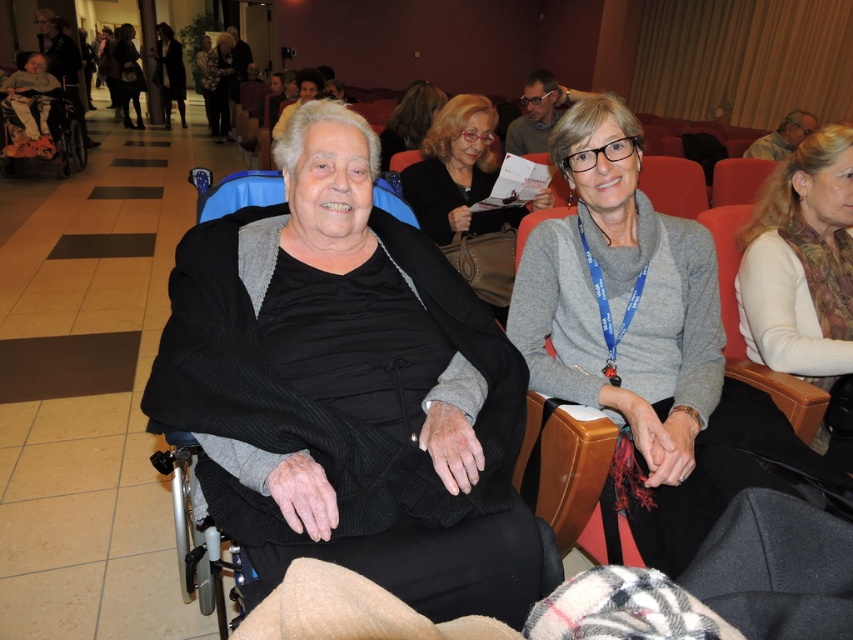
Question: Can you confirm if black knit sweater at center is bigger than matte black dress at center?

Choices:
 (A) no
 (B) yes

Answer: (A)

Question: Does matte gray sweater at center appear on the right side of matte black dress at upper left?

Choices:
 (A) yes
 (B) no

Answer: (A)

Question: Estimate the real-world distances between objects in this image. Which object is closer to the matte black sweater at center?

Choices:
 (A) gray wool sweater at center
 (B) matte gray sweater at center
 (C) leather-like brown chair at right

Answer: (B)

Question: Which of the following is the farthest from the observer?

Choices:
 (A) (434, 88)
 (B) (840, 365)
 (C) (209, 64)
 (D) (177, 93)

Answer: (D)

Question: Which of the following is the closest to the observer?

Choices:
 (A) (212, 129)
 (B) (461, 144)
 (C) (300, 353)

Answer: (C)

Question: Is gray wool sweater at center wider than metallic wheelchair at left?

Choices:
 (A) no
 (B) yes

Answer: (B)